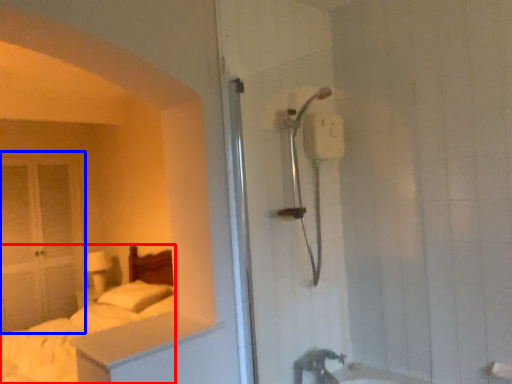
Question: Among these objects, which one is nearest to the camera, bed (highlighted by a red box) or glass door (highlighted by a blue box)?

Choices:
 (A) bed
 (B) glass door

Answer: (A)